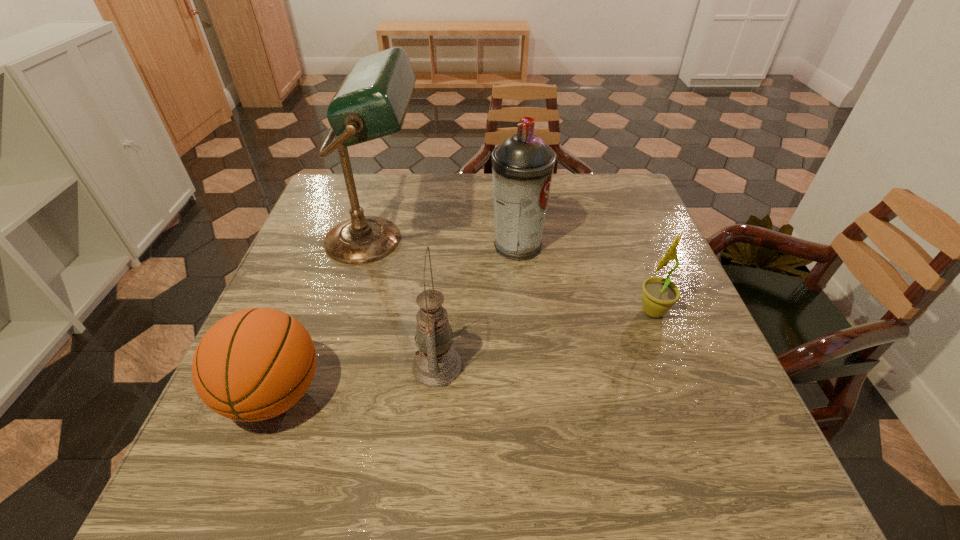
I want to click on vacant region at the near edge of the desktop, so click(512, 447).

Where is `vacant space at the right edge of the desktop`? The image size is (960, 540). vacant space at the right edge of the desktop is located at coordinates (660, 347).

Locate an element on the screen. This screenshot has height=540, width=960. free location at the far left corner of the desktop is located at coordinates (371, 189).

Identify the location of vacant area at the near left corner of the desktop. [x=276, y=464].

In the image, there is a desktop. Where is `blank space at the near right corner`? This screenshot has width=960, height=540. blank space at the near right corner is located at coordinates (733, 490).

In order to click on vacant point located between the third object from left to right and the aerosol can in this screenshot , I will do `click(477, 306)`.

I want to click on vacant space that is in between the third tallest object and the tallest object, so click(x=406, y=303).

I want to click on empty location between the aerosol can and the rightmost object, so click(x=585, y=278).

The image size is (960, 540). I want to click on vacant area that lies between the table lamp and the third shortest object, so click(406, 303).

Where is `empty space between the basketball and the tallest object`? This screenshot has height=540, width=960. empty space between the basketball and the tallest object is located at coordinates (324, 317).